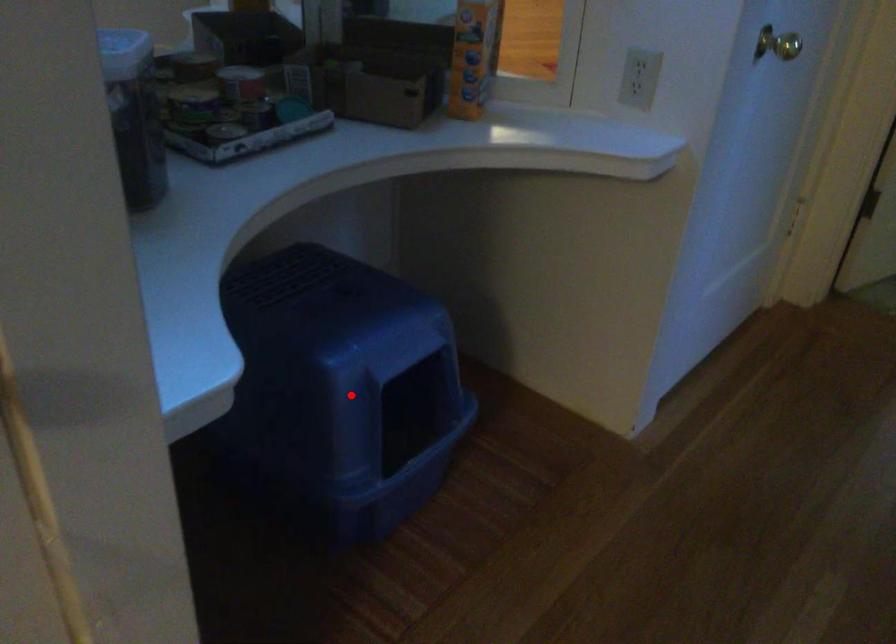
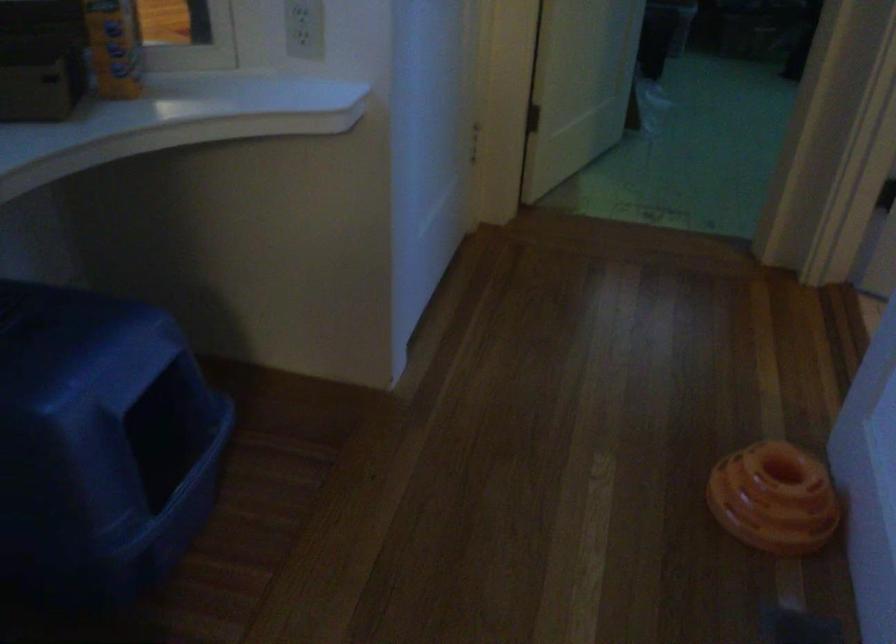
Question: I am providing you with two images of the same scene from different viewpoints. Given a red point in image1, look at the same physical point in image2. Is it:

Choices:
 (A) Closer to the viewpoint
 (B) Farther from the viewpoint

Answer: (A)